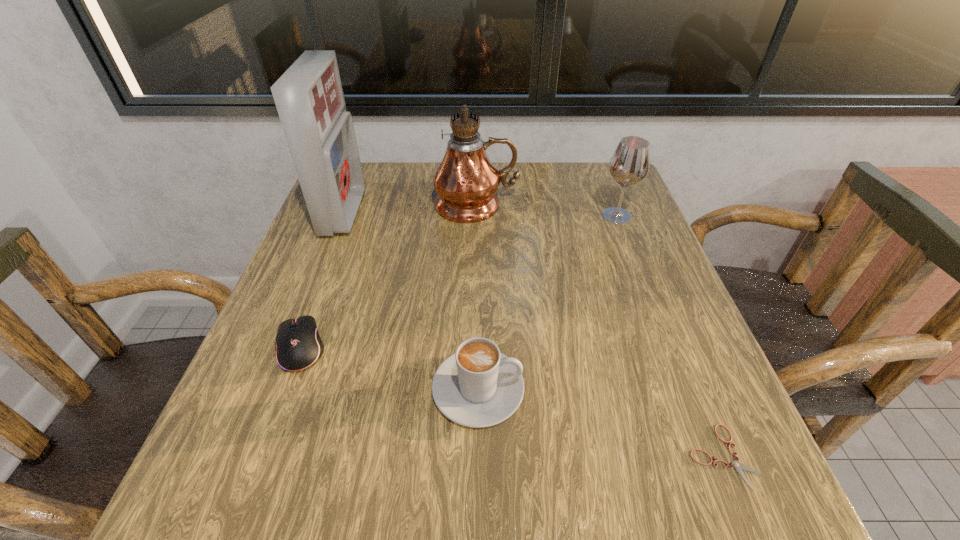
You are a GUI agent. You are given a task and a screenshot of the screen. Output one action in this format:
    pyautogui.click(x=<x>, y=<y>)
    Task: Click on the tallest object
    
    Given the screenshot: What is the action you would take?
    pyautogui.click(x=466, y=180)

Where is `the fifth shortest object`? This screenshot has width=960, height=540. the fifth shortest object is located at coordinates (309, 98).

Identify the location of the third tallest object. This screenshot has width=960, height=540. (630, 162).

Where is `cappuccino`? cappuccino is located at coordinates (478, 386).

The width and height of the screenshot is (960, 540). I want to click on computer mouse, so click(298, 345).

Find the location of `the shortest object`. the shortest object is located at coordinates (738, 466).

Where is `blank space located on the right of the oil lamp`? The height and width of the screenshot is (540, 960). blank space located on the right of the oil lamp is located at coordinates (548, 204).

Find the location of a particular element. This screenshot has height=540, width=960. vacant space located 0.190m on the front-facing side of the first-aid kit is located at coordinates (440, 213).

This screenshot has height=540, width=960. I want to click on vacant space located 0.170m on the back of the wineglass, so click(599, 170).

At what (x,y) coordinates should I click in order to perform the action: click on vacant space located 0.080m to the right of the cappuccino. Please return your answer as a coordinate pair (x, y). The height and width of the screenshot is (540, 960). Looking at the image, I should click on [575, 389].